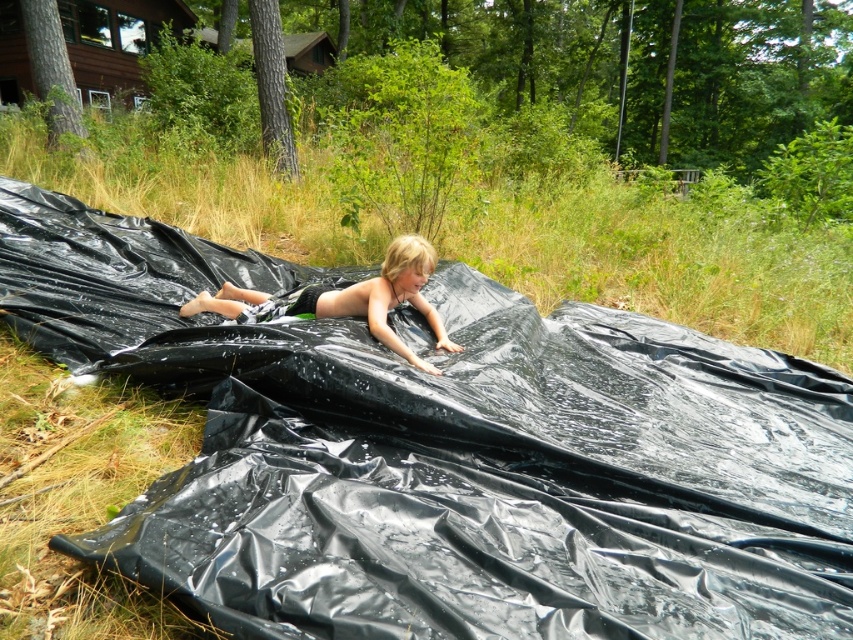
You are a parent supervising a child in the scene. You need to ensure the child is visible at all times. Given the green grass at center and the blonde hair boy at center, which object is taller and might block your view of the child?

The green grass at center is much taller than the blonde hair boy at center, so the grass could block your view of the child.

Based on the scene description, which object is wider, the green grass at center or the blonde hair boy at center?

The green grass at center is wider than the blonde hair boy at center according to the description.

Consider the image. You are a parent supervising the child on the black tarp. You notice the green grass at center and the blonde hair boy at center. Which object is higher up in the image?

The green grass at center is above the blonde hair boy at center, so the green grass at center is higher up in the image.